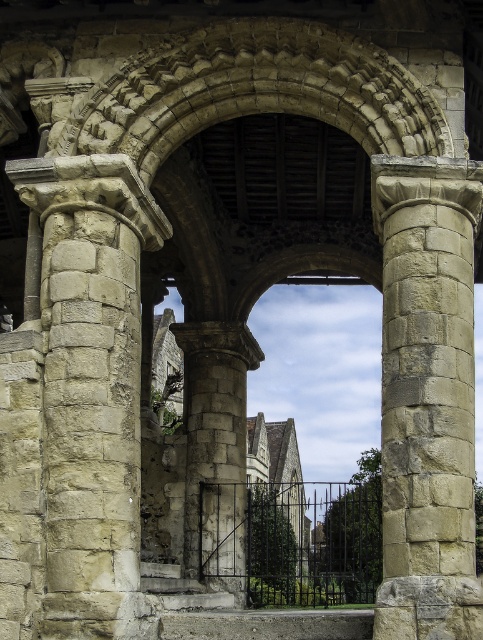
Question: Does stone textured column at left have a smaller size compared to gray stone pillar at center?

Choices:
 (A) yes
 (B) no

Answer: (B)

Question: Which object appears closest to the camera in this image?

Choices:
 (A) gray stone pillar at center
 (B) stone textured column at left
 (C) beige stone column at center

Answer: (C)

Question: Is stone textured column at left further to the viewer compared to gray stone pillar at center?

Choices:
 (A) yes
 (B) no

Answer: (B)

Question: Among these points, which one is farthest from the camera?

Choices:
 (A) (208, 365)
 (B) (127, 618)
 (C) (434, 388)

Answer: (A)

Question: Which object is the farthest from the beige stone column at center?

Choices:
 (A) stone textured column at left
 (B) gray stone pillar at center

Answer: (B)

Question: Is stone textured column at left smaller than gray stone pillar at center?

Choices:
 (A) no
 (B) yes

Answer: (A)